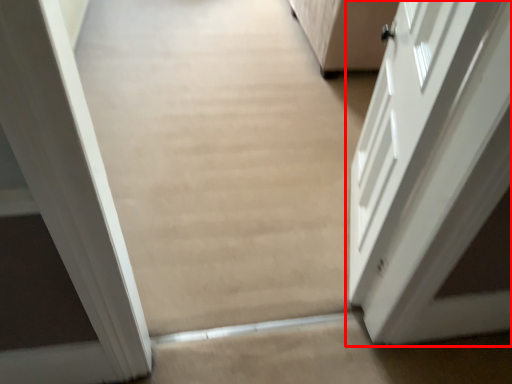
Question: From the image, what is the correct spatial relationship of door (annotated by the red box) in relation to plain?

Choices:
 (A) left
 (B) right

Answer: (B)